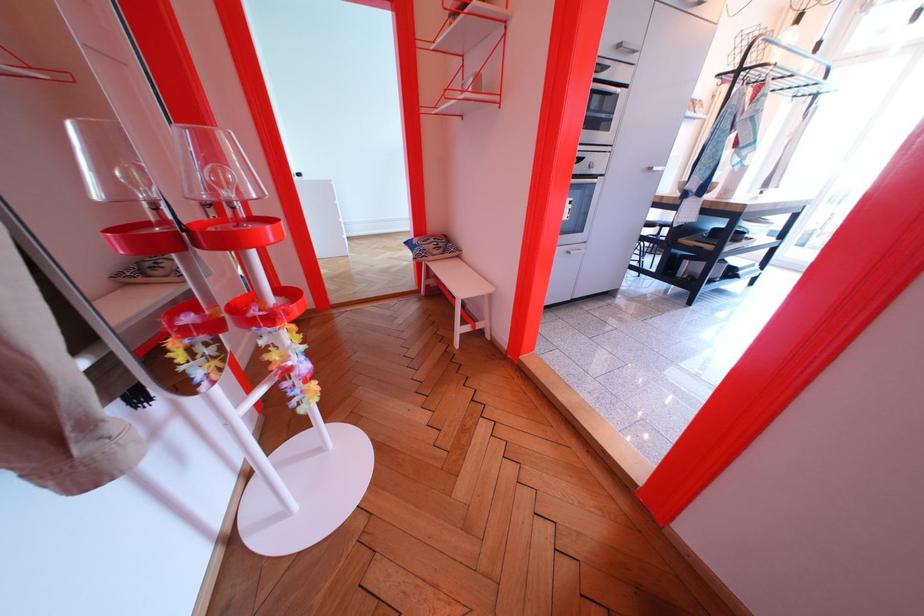
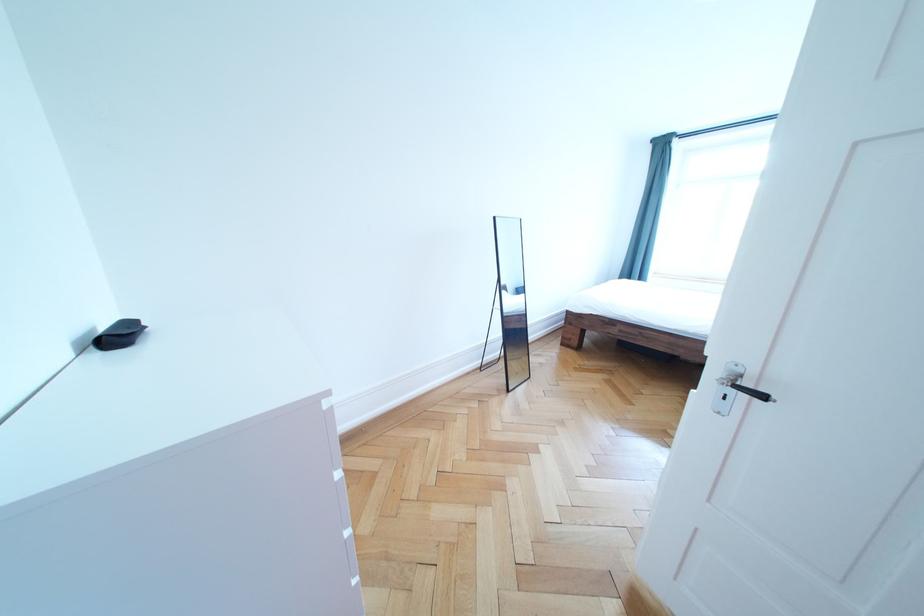
Which direction would the cameraman need to move to produce the second image?

The cameraman moved toward left, forward.